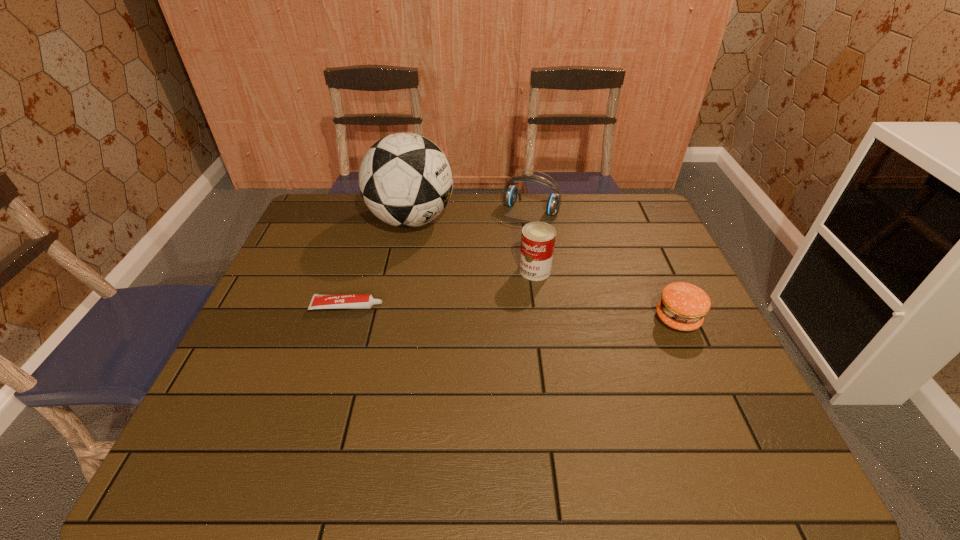
You are a GUI agent. You are given a task and a screenshot of the screen. Output one action in this format:
    pyautogui.click(x=<x>, y=<y>)
    Task: Click on the object positioned at the right edge
    
    Given the screenshot: What is the action you would take?
    pyautogui.click(x=683, y=305)

In order to click on vacant space at the far edge of the desktop in this screenshot , I will do `click(458, 202)`.

Identify the location of free point at the near edge. This screenshot has height=540, width=960. (518, 404).

Find the location of `free space at the left edge of the desktop`. free space at the left edge of the desktop is located at coordinates (278, 282).

In the image, there is a desktop. Where is `vacant space at the right edge`? This screenshot has height=540, width=960. vacant space at the right edge is located at coordinates click(x=681, y=280).

In the image, there is a desktop. At what (x,y) coordinates should I click in order to perform the action: click on vacant region at the far left corner. Please return your answer as a coordinate pair (x, y). Looking at the image, I should click on click(x=303, y=224).

Find the location of a particular element. free region at the far right corner is located at coordinates (645, 199).

Identify the location of vacant area between the toothpaste and the second shortest object. (513, 313).

You are a GUI agent. You are given a task and a screenshot of the screen. Output one action in this format:
    pyautogui.click(x=<x>, y=<y>)
    Task: Click on the free spot between the headset and the soccer ball
    The height and width of the screenshot is (540, 960).
    Given the screenshot: What is the action you would take?
    pyautogui.click(x=471, y=214)

This screenshot has height=540, width=960. Find the location of `vacant space in between the headset and the tallest object`. vacant space in between the headset and the tallest object is located at coordinates pos(471,214).